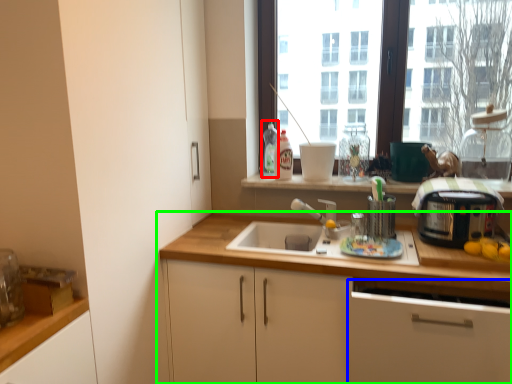
Question: Which object is positioned closest to bottle (highlighted by a red box)? Select from cabinetry (highlighted by a blue box) and cabinetry (highlighted by a green box).

Choices:
 (A) cabinetry
 (B) cabinetry

Answer: (B)